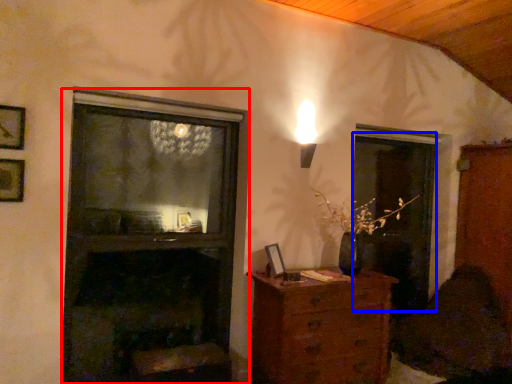
Question: Which object appears farthest to the camera in this image, fireplace (highlighted by a red box) or screen door (highlighted by a blue box)?

Choices:
 (A) fireplace
 (B) screen door

Answer: (B)